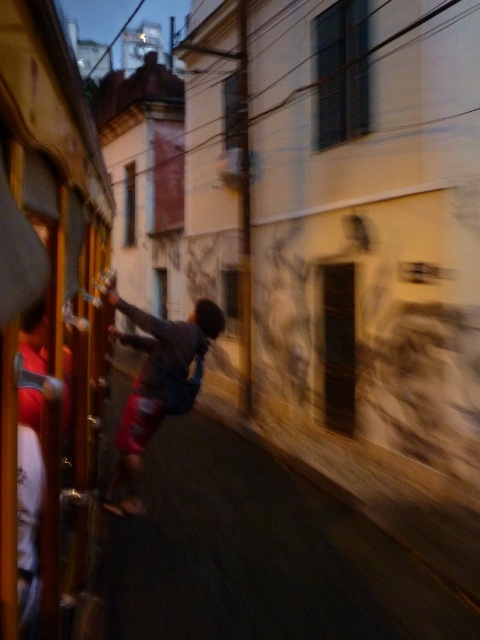
Question: Is the position of metallic silver train car at left more distant than that of dark glass window at upper center?

Choices:
 (A) no
 (B) yes

Answer: (A)

Question: Based on their relative distances, which object is farther from the light gray fabric shirt at center?

Choices:
 (A) clear glass window at center
 (B) dark glass window at upper center
 (C) smooth glass window at center

Answer: (C)

Question: Which object is farther from the camera taking this photo?

Choices:
 (A) smooth glass window at center
 (B) dark glass window at upper center

Answer: (A)

Question: Can you confirm if metallic silver train car at left is positioned below clear glass window at center?

Choices:
 (A) no
 (B) yes

Answer: (B)

Question: Which object appears farthest from the camera in this image?

Choices:
 (A) light gray fabric shirt at center
 (B) clear glass window at center
 (C) metallic silver train car at left
 (D) dark glass window at upper center

Answer: (B)

Question: Does light gray fabric shirt at center have a larger size compared to clear glass window at center?

Choices:
 (A) yes
 (B) no

Answer: (A)